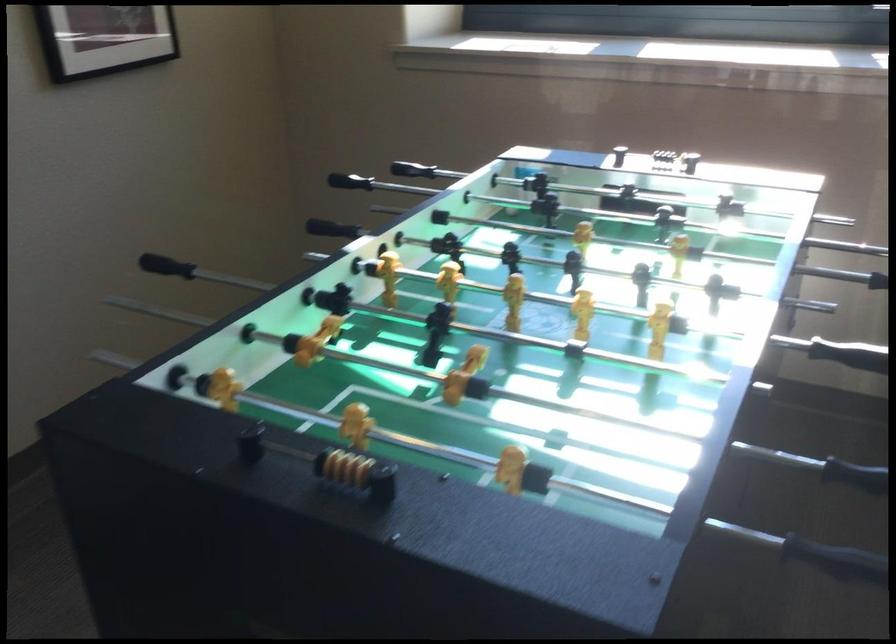
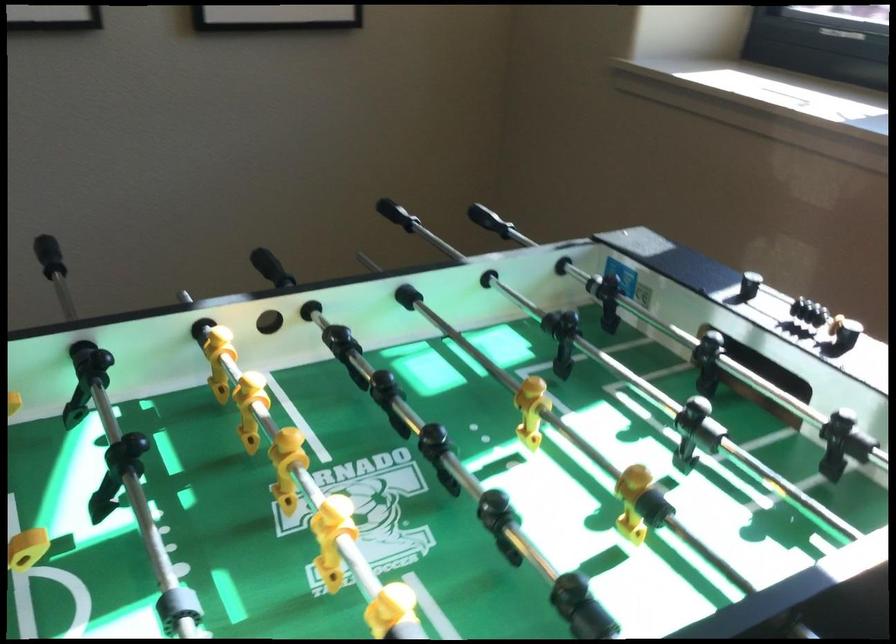
Where in the second image is the point corresponding to (219,212) from the first image?

(397, 214)